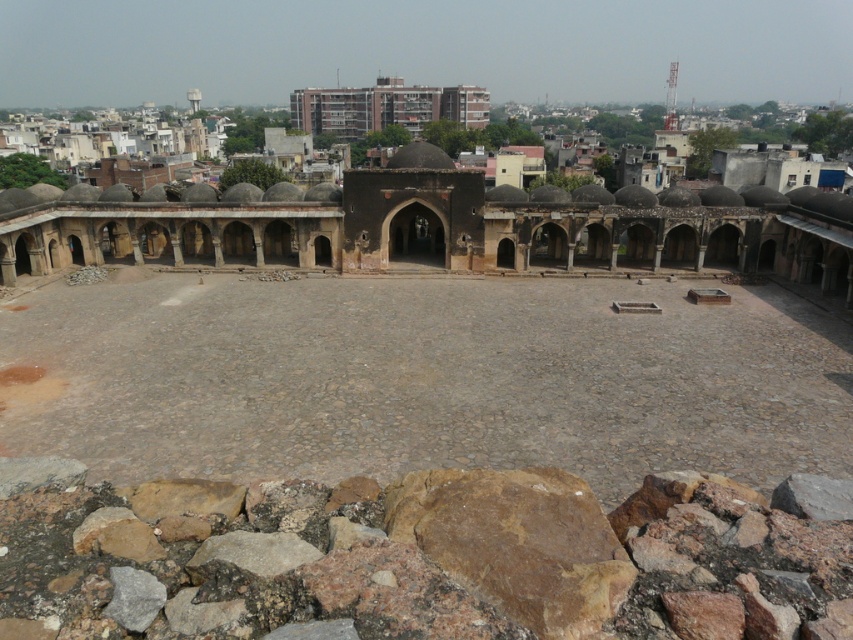
Question: Does dark brown stone amphitheater at center appear over brick building at upper center?

Choices:
 (A) no
 (B) yes

Answer: (A)

Question: In this image, where is gray stone courtyard at center located relative to brick building at upper center?

Choices:
 (A) left
 (B) right

Answer: (B)

Question: Which point is closer to the camera?

Choices:
 (A) (436, 534)
 (B) (352, 129)
 (C) (469, 339)

Answer: (A)

Question: Is brown rough rock at lower center to the left of dark brown stone amphitheater at center from the viewer's perspective?

Choices:
 (A) yes
 (B) no

Answer: (A)

Question: Which of the following is the closest to the observer?

Choices:
 (A) brick building at upper center
 (B) brown rough rock at lower center
 (C) gray stone courtyard at center
 (D) dark brown stone amphitheater at center

Answer: (B)

Question: Estimate the real-world distances between objects in this image. Which object is closer to the brick building at upper center?

Choices:
 (A) dark brown stone amphitheater at center
 (B) gray stone courtyard at center

Answer: (A)